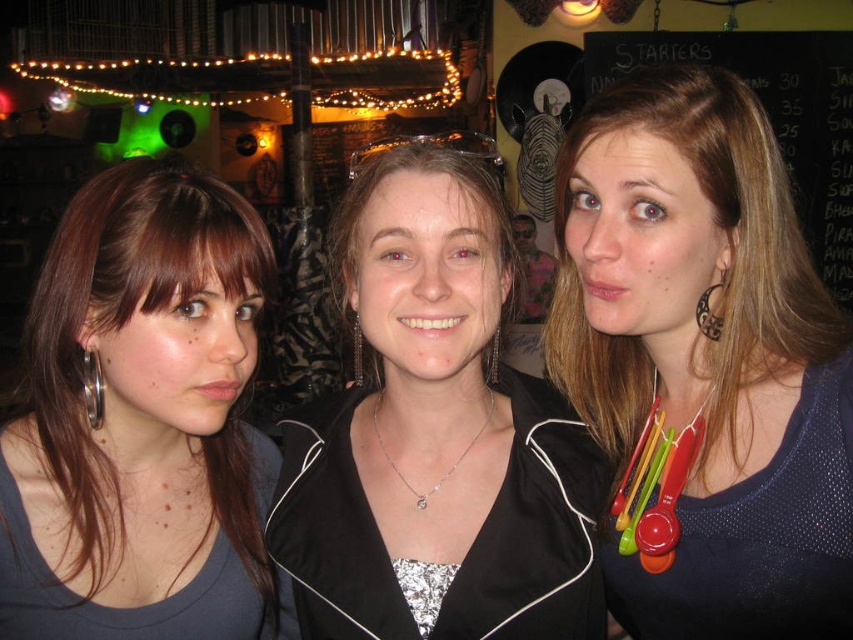
Does matte gray tank top at left appear under silver metallic hoop at center?

Yes, matte gray tank top at left is below silver metallic hoop at center.

Locate an element on the screen. The height and width of the screenshot is (640, 853). matte gray tank top at left is located at coordinates (140, 404).

Does black matte jacket at center have a larger size compared to matte gray tank top at left?

Indeed, black matte jacket at center has a larger size compared to matte gray tank top at left.

Is point (502, 237) more distant than point (234, 609)?

No, (502, 237) is closer to viewer.

Between point (422, 268) and point (195, 275), which one is positioned behind?

The point (195, 275) is more distant.

I want to click on black matte jacket at center, so click(x=436, y=436).

Does black matte jacket at center appear on the right side of silver metallic hoop at center?

Yes, black matte jacket at center is to the right of silver metallic hoop at center.

Is point (332, 412) positioned behind point (357, 321)?

Yes, it is behind point (357, 321).

Between point (512, 419) and point (357, 371), which one is positioned behind?

The point (357, 371) is behind.

The image size is (853, 640). In order to click on black matte jacket at center in this screenshot , I will do `click(436, 436)`.